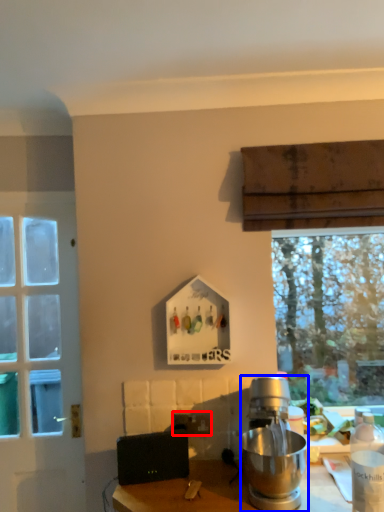
Question: Among these objects, which one is farthest to the camera, power outlet (highlighted by a red box) or kitchen appliance (highlighted by a blue box)?

Choices:
 (A) power outlet
 (B) kitchen appliance

Answer: (A)